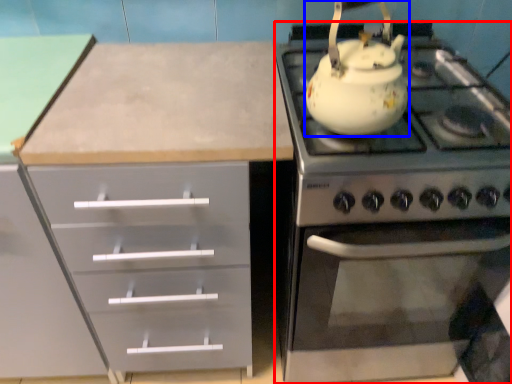
Question: Which point is further to the camera, appliance (highlighted by a red box) or kettle (highlighted by a blue box)?

Choices:
 (A) appliance
 (B) kettle

Answer: (A)